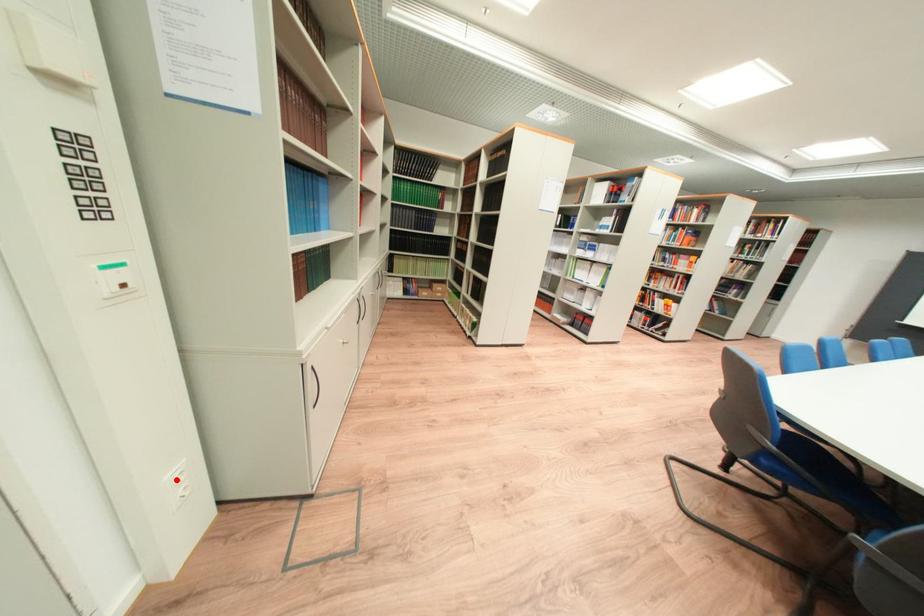
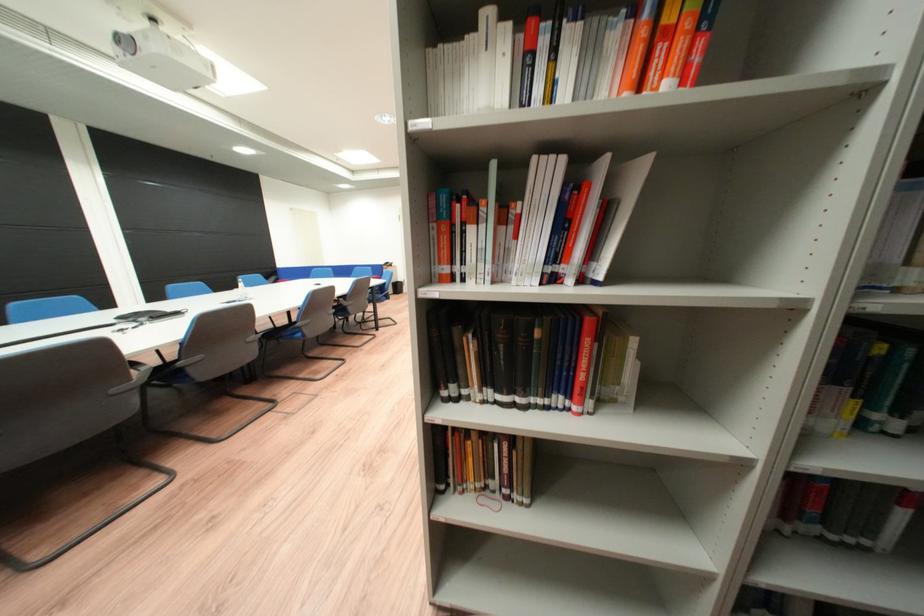
Question: I am providing you with two images of the same scene from different viewpoints. A red point is marked on the first image. Is the red point's position out of view in image 2?

Choices:
 (A) Yes
 (B) No

Answer: (A)